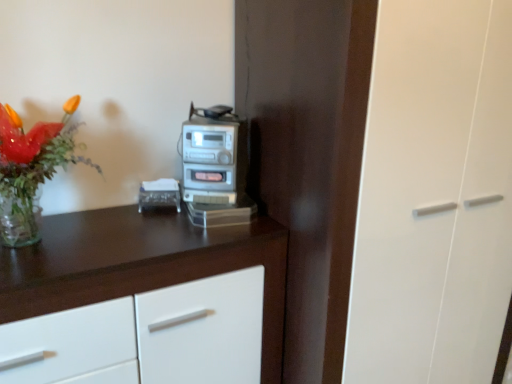
This screenshot has width=512, height=384. Identify the location of free spot in front of clear plastic tissue box at center. (158, 231).